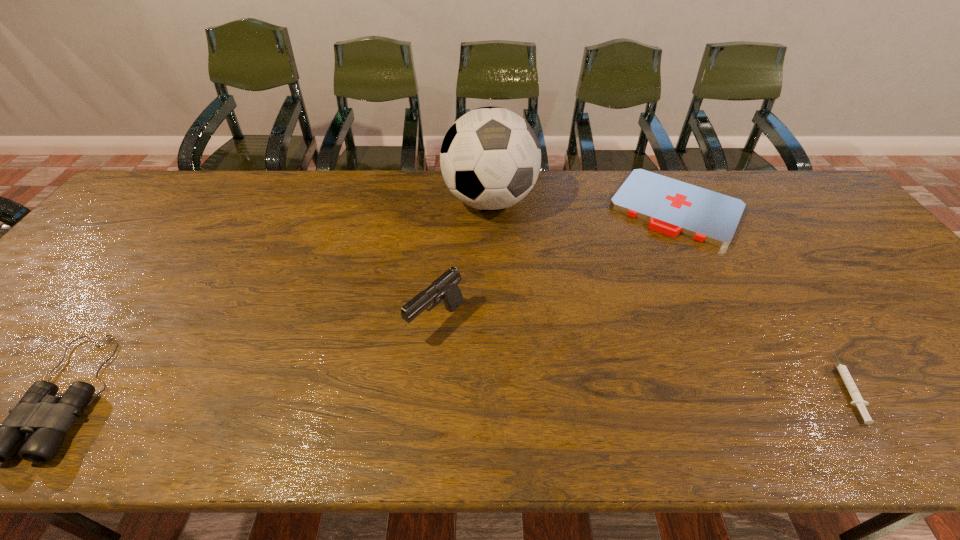
Find the location of a particular element. The image size is (960, 540). syringe is located at coordinates (858, 401).

Locate an element on the screen. The height and width of the screenshot is (540, 960). pistol is located at coordinates (445, 287).

Where is `the first-aid kit`? The height and width of the screenshot is (540, 960). the first-aid kit is located at coordinates (671, 207).

Find the location of a particular element. the tallest object is located at coordinates (490, 158).

The width and height of the screenshot is (960, 540). What are the coordinates of `vacant space situated 0.080m on the right of the syringe` in the screenshot? It's located at (891, 386).

Locate an element on the screen. The width and height of the screenshot is (960, 540). free space located 0.060m aim along the barrel of the pistol is located at coordinates (397, 358).

I want to click on vacant area situated aim along the barrel of the pistol, so click(x=363, y=389).

You are a GUI agent. You are given a task and a screenshot of the screen. Output one action in this format:
    pyautogui.click(x=<x>, y=<y>)
    Task: Click on the vacant space located 0.080m aim along the barrel of the pistol
    The width and height of the screenshot is (960, 540).
    Given the screenshot: What is the action you would take?
    pyautogui.click(x=391, y=364)

At what (x,y) coordinates should I click in order to perform the action: click on vacant point located on handle side the first-aid kit. Please return your answer as a coordinate pair (x, y). Looking at the image, I should click on (635, 274).

The height and width of the screenshot is (540, 960). What are the coordinates of `vacant space located on handle side the first-aid kit` in the screenshot? It's located at point(615,305).